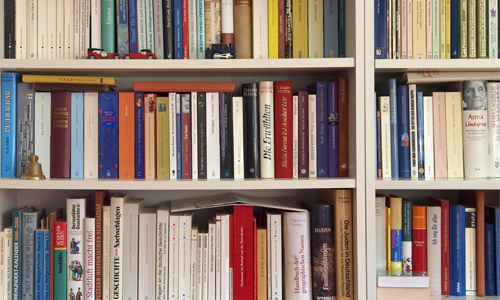
Where is `shelves`? The image size is (500, 300). shelves is located at coordinates (136, 185), (170, 63), (437, 63), (423, 187).